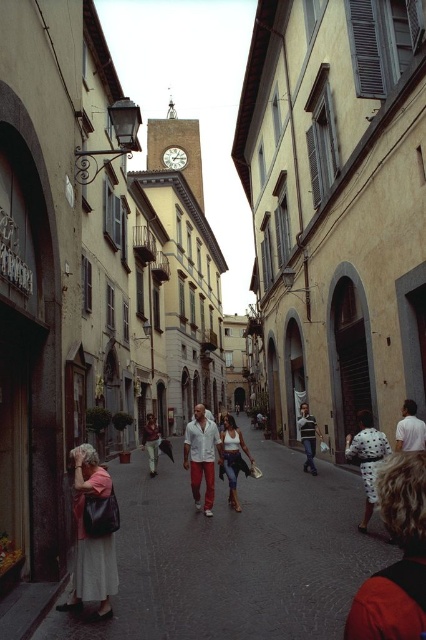
Does white cotton dress at lower left appear over matte pink dress at lower left?

No.

Who is lower down, white cotton dress at lower left or matte pink dress at lower left?

Positioned lower is white cotton dress at lower left.

Between point (250, 436) and point (77, 566), which one is positioned in front?

Point (77, 566) is in front.

I want to click on white cotton dress at lower left, so click(x=236, y=554).

Does fluffy fur coat at lower right come behind matte white pants at center?

No, fluffy fur coat at lower right is in front of matte white pants at center.

Who is more forward, (397, 592) or (152, 428)?

Point (397, 592) is more forward.

Locate an element on the screen. fluffy fur coat at lower right is located at coordinates (397, 561).

Is point (187, 435) positioned behind point (236, 433)?

No.

Who is more distant from viewer, (195,454) or (230,461)?

Positioned behind is point (195,454).

This screenshot has width=426, height=640. What are the coordinates of `white cotton shirt at center` in the screenshot? It's located at (201, 456).